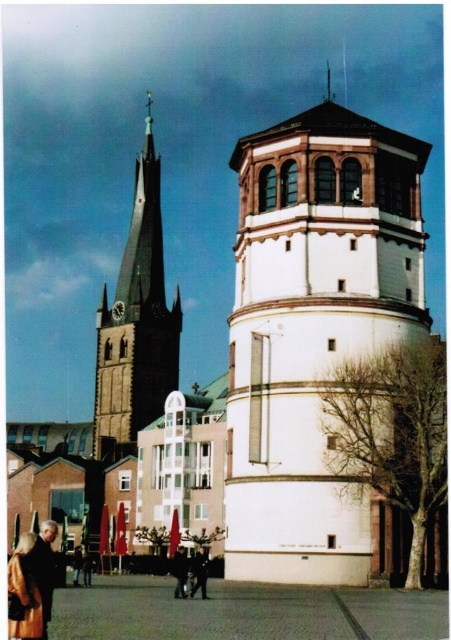
Question: Which object appears closest to the camera in this image?

Choices:
 (A) dark brown leather jacket at lower center
 (B) dark brown leather jacket at lower left
 (C) golden textured coat at lower left
 (D) dark blue jeans at center

Answer: (C)

Question: Is dark gray stone tower at left above dark blue jeans at center?

Choices:
 (A) no
 (B) yes

Answer: (B)

Question: Does white smooth tower at center come in front of dark gray stone tower at left?

Choices:
 (A) yes
 (B) no

Answer: (A)

Question: Estimate the real-world distances between objects in this image. Which object is farther from the dark blue jeans at center?

Choices:
 (A) dark brown leather jacket at lower center
 (B) dark brown leather jacket at lower left
 (C) golden textured coat at lower left

Answer: (C)

Question: Is dark gray stone tower at left behind dark brown leather jacket at lower center?

Choices:
 (A) yes
 (B) no

Answer: (A)

Question: Which point appears closest to the camera in this image?

Choices:
 (A) (383, 205)
 (B) (161, 285)
 (C) (30, 582)

Answer: (C)